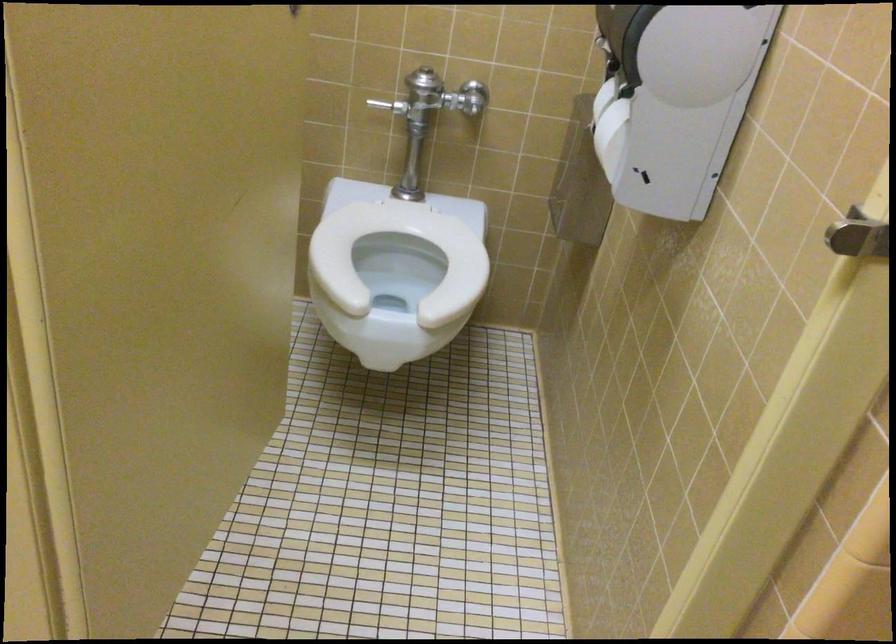
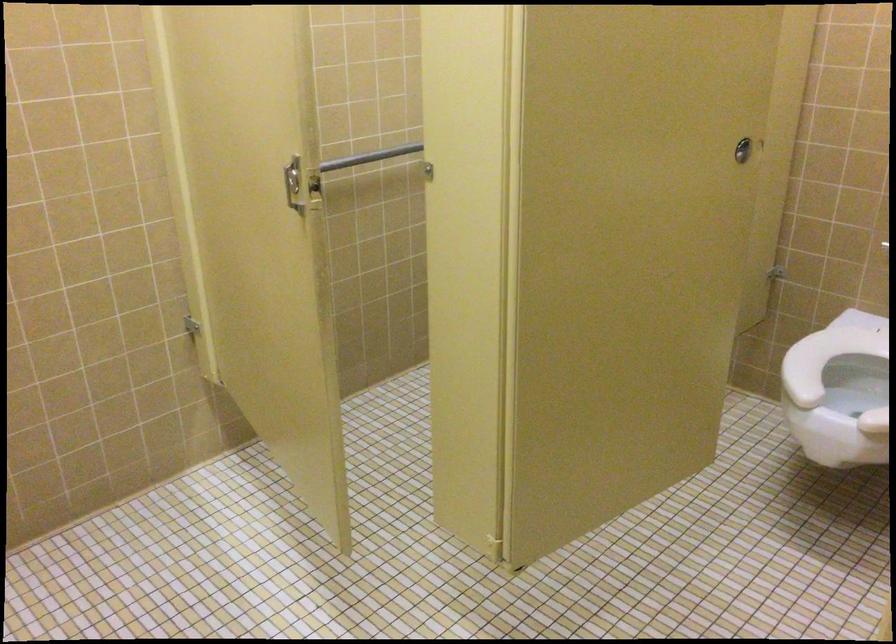
Question: The camera is either moving clockwise (left) or counter-clockwise (right) around the object. The first image is from the beginning of the video and the second image is from the end. Is the camera moving left or right when shooting the video?

Choices:
 (A) Left
 (B) Right

Answer: (B)